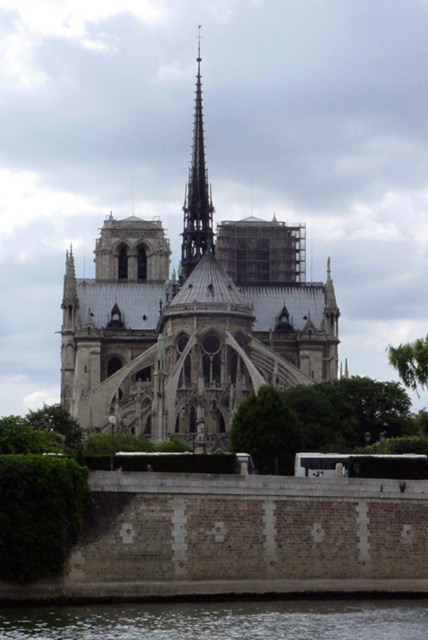
You are standing on the riverbank looking at the Notre Dame Cathedral. There are two points marked on the wall in front of you. One is at coordinate point (291, 416) and the other at point (196, 58). Which point is closer to you?

Point (291, 416) is closer to the camera than point (196, 58).

You are a tourist standing on the riverbank looking at the Notre Dame Cathedral. You see the dark gray water at lower center and the smooth gray spire at center. Which object is positioned to the right side from your viewpoint?

The dark gray water at lower center is positioned to the right of the smooth gray spire at center.

You are standing on the riverbank and want to take a photo of the stone gothic cathedral at center and the dark gray water at lower center. Which object is positioned to the left side of the other?

The stone gothic cathedral at center is to the left of dark gray water at lower center.